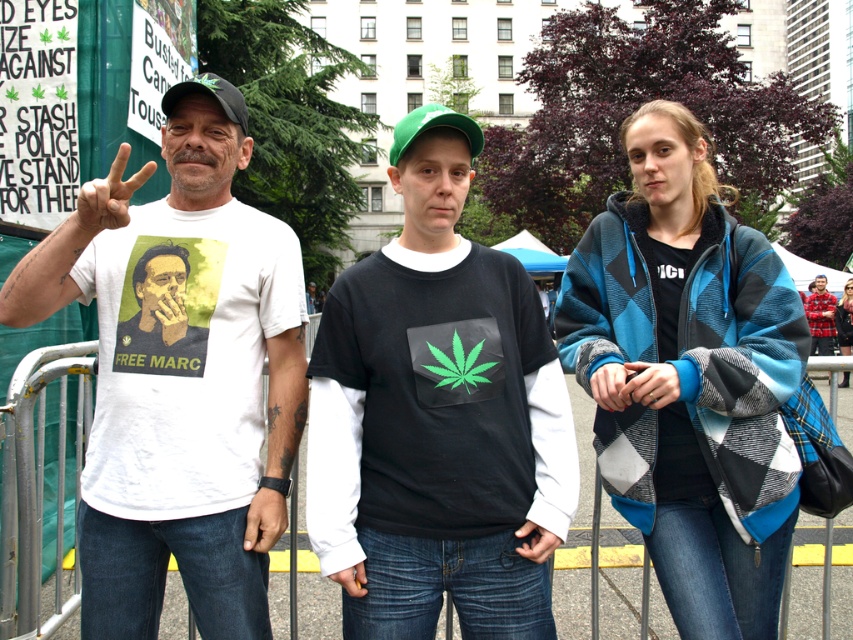
Can you confirm if matte skin hand at center is positioned below plaid flannel shirt at center?

Incorrect, matte skin hand at center is not positioned below plaid flannel shirt at center.

Between point (100, 204) and point (842, 385), which one is positioned in front?

Point (100, 204)

You are a GUI agent. You are given a task and a screenshot of the screen. Output one action in this format:
    pyautogui.click(x=<x>, y=<y>)
    Task: Click on the matte skin hand at center
    
    Given the screenshot: What is the action you would take?
    pyautogui.click(x=108, y=196)

Does point (473, 502) come behind point (813, 292)?

No, (473, 502) is closer to viewer.

Who is positioned more to the right, black matte shirt at center or red plaid shirt at center?

red plaid shirt at center

Locate an element on the screen. black matte shirt at center is located at coordinates (436, 417).

Where is `black matte shirt at center`? black matte shirt at center is located at coordinates (436, 417).

Is black matte shirt at center to the right of metal at center from the viewer's perspective?

Indeed, black matte shirt at center is positioned on the right side of metal at center.

Where is `black matte shirt at center`? The height and width of the screenshot is (640, 853). black matte shirt at center is located at coordinates [436, 417].

Identify the location of black matte shirt at center. The image size is (853, 640). (436, 417).